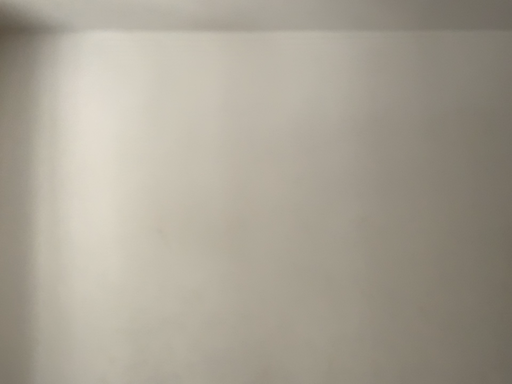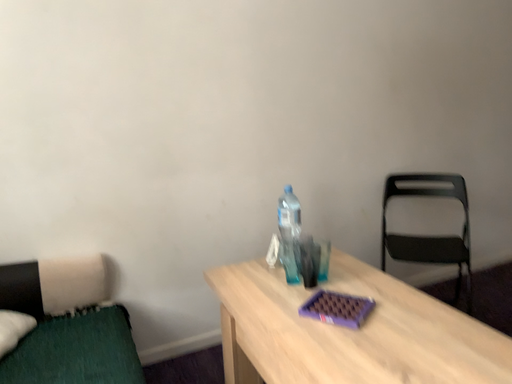
Question: How did the camera likely rotate when shooting the video?

Choices:
 (A) rotated downward
 (B) rotated upward

Answer: (A)